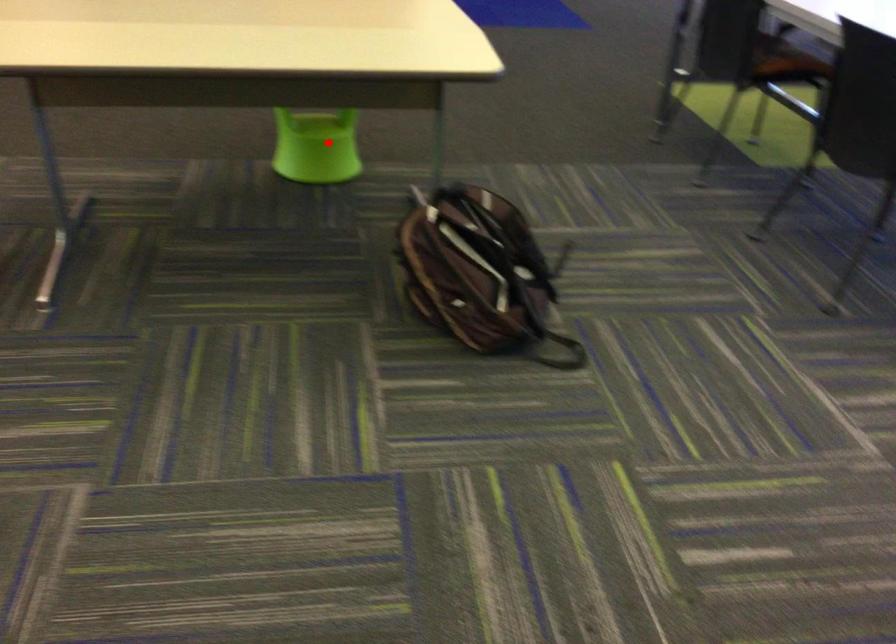
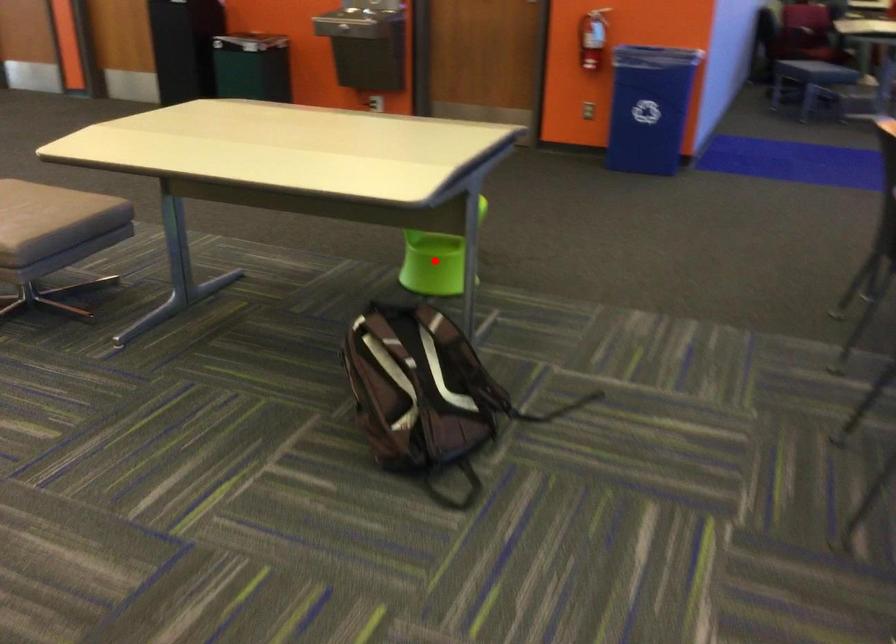
I am providing you with two images of the same scene from different viewpoints. A red point is marked on the first image and another point is marked on the second image. Do the highlighted points in image1 and image2 indicate the same real-world spot?

Yes